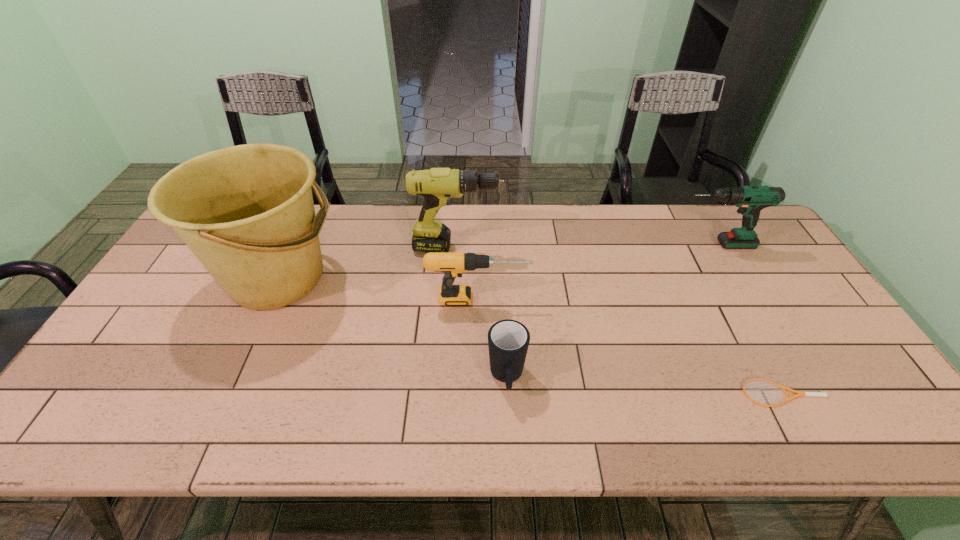
At what (x,y) coordinates should I click in order to perform the action: click on drill present at the right edge. Please return your answer as a coordinate pair (x, y). This screenshot has width=960, height=540. Looking at the image, I should click on (751, 200).

Where is `tennis racket that is at the right edge`? tennis racket that is at the right edge is located at coordinates (783, 388).

Locate an element on the screen. The width and height of the screenshot is (960, 540). object that is at the far left corner is located at coordinates (247, 213).

Where is `object that is positioned at the far right corner`? This screenshot has width=960, height=540. object that is positioned at the far right corner is located at coordinates (751, 200).

Locate an element on the screen. Image resolution: width=960 pixels, height=540 pixels. object located in the near right corner section of the desktop is located at coordinates (783, 388).

In the image, there is a desktop. At what (x,y) coordinates should I click in order to perform the action: click on free space at the far edge. Please return your answer as a coordinate pair (x, y). This screenshot has width=960, height=540. Looking at the image, I should click on (702, 248).

Where is `free space at the near edge of the desktop`? The height and width of the screenshot is (540, 960). free space at the near edge of the desktop is located at coordinates (280, 436).

In order to click on free point at the left edge in this screenshot , I will do `click(179, 259)`.

You are a GUI agent. You are given a task and a screenshot of the screen. Output one action in this format:
    pyautogui.click(x=<x>, y=<y>)
    Task: Click on the vacant space at the right edge of the desktop
    The width and height of the screenshot is (960, 540).
    Given the screenshot: What is the action you would take?
    pyautogui.click(x=779, y=275)

Locate an element on the screen. This screenshot has width=960, height=540. free space between the shortest object and the tallest object is located at coordinates (531, 335).